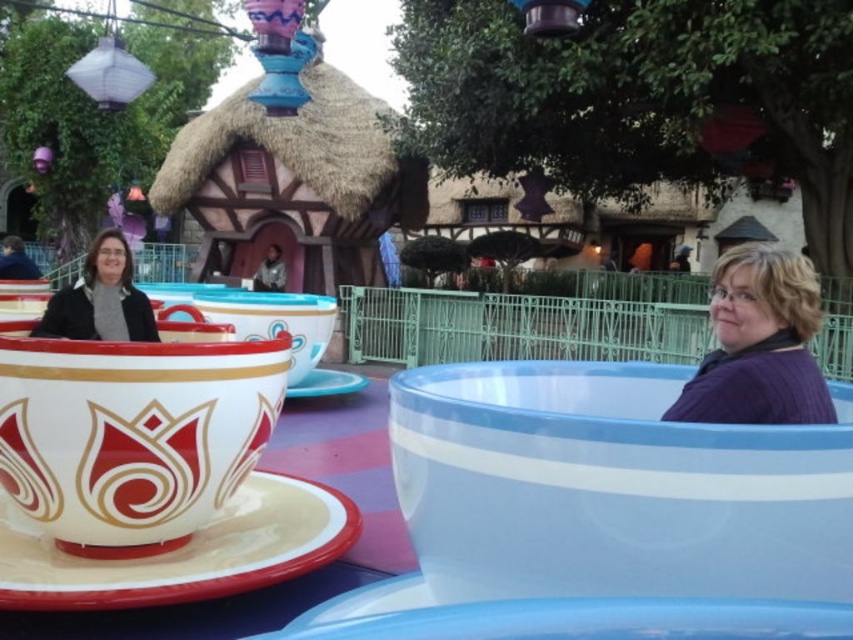
Between matte white saucer at lower left and white glossy saucer at center, which one appears on the left side from the viewer's perspective?

matte white saucer at lower left

Does matte white saucer at lower left appear on the left side of white glossy saucer at center?

Correct, you'll find matte white saucer at lower left to the left of white glossy saucer at center.

Who is more forward, [138,570] or [329,380]?

Point [138,570] is in front.

You are a GUI agent. You are given a task and a screenshot of the screen. Output one action in this format:
    pyautogui.click(x=<x>, y=<y>)
    Task: Click on the matte white saucer at lower left
    This screenshot has width=853, height=640.
    Given the screenshot: What is the action you would take?
    pyautogui.click(x=186, y=552)

This screenshot has height=640, width=853. What are the coordinates of `matte white saucer at lower left` in the screenshot? It's located at (186, 552).

Is matte white saucer at lower left closer to the viewer compared to matte black sweater at left?

Yes.

Between point (4, 512) and point (96, 260), which one is positioned in front?

Point (4, 512) is more forward.

Find the location of `matte white saucer at lower left`. matte white saucer at lower left is located at coordinates (186, 552).

Which of these two, matte white teacup at center or matte white saucer at lower left, stands shorter?

Standing shorter between the two is matte white saucer at lower left.

Describe the element at coordinates (132, 433) in the screenshot. I see `matte white teacup at center` at that location.

Identify the location of matte white teacup at center. The height and width of the screenshot is (640, 853). (132, 433).